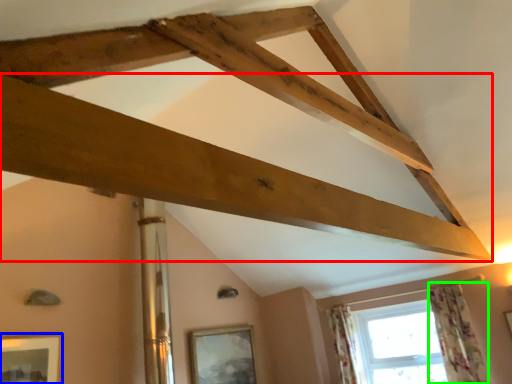
Question: Based on their relative distances, which object is nearer to plank (highlighted by a red box)? Choose from picture frame (highlighted by a blue box) and curtain (highlighted by a green box).

Choices:
 (A) picture frame
 (B) curtain

Answer: (B)